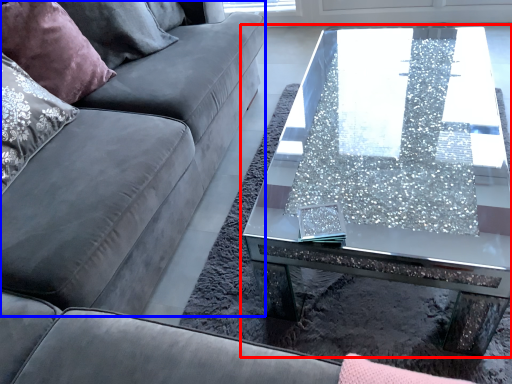
Question: Which point is further to the camera, coffee table (highlighted by a red box) or couch (highlighted by a blue box)?

Choices:
 (A) coffee table
 (B) couch

Answer: (A)